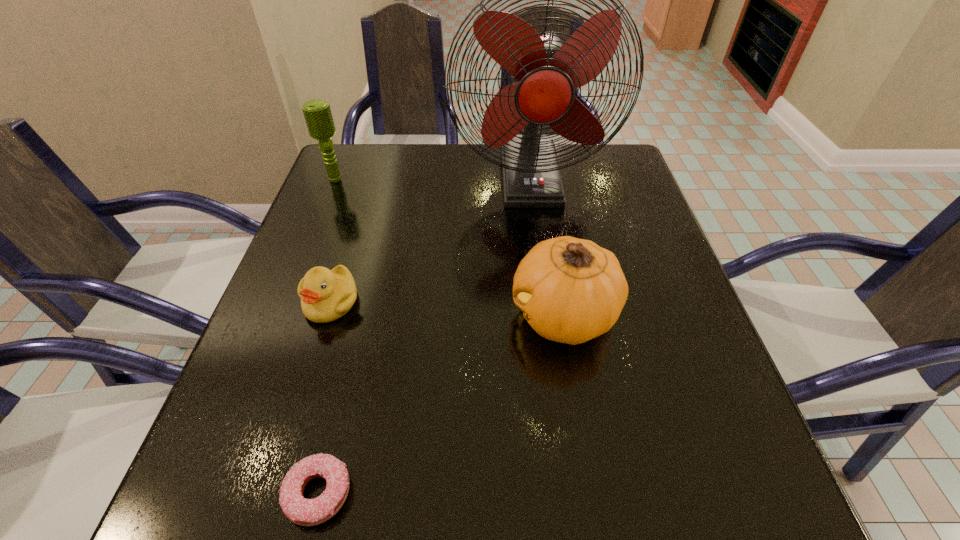
Locate an element on the screen. free space between the pumpkin and the microphone is located at coordinates (449, 247).

Where is `vacant area that lies between the microphone and the second shortest object`? Image resolution: width=960 pixels, height=540 pixels. vacant area that lies between the microphone and the second shortest object is located at coordinates (333, 240).

You are a GUI agent. You are given a task and a screenshot of the screen. Output one action in this format:
    pyautogui.click(x=<x>, y=<y>)
    Task: Click on the vacant area between the microphone and the tallest object
    
    Given the screenshot: What is the action you would take?
    pyautogui.click(x=433, y=178)

This screenshot has height=540, width=960. I want to click on free space between the second shortest object and the pumpkin, so click(x=447, y=308).

I want to click on blank region between the shortest object and the microphone, so click(327, 335).

You are a GUI agent. You are given a task and a screenshot of the screen. Output one action in this format:
    pyautogui.click(x=<x>, y=<y>)
    Task: Click on the vacant area that lies between the doughnut and the duckling
    
    Given the screenshot: What is the action you would take?
    point(324,397)

This screenshot has width=960, height=540. Identify the location of vacant area between the pumpkin and the second shortest object. (447, 308).

This screenshot has height=540, width=960. I want to click on free area in between the pumpkin and the microphone, so click(449, 247).

Locate an element on the screen. This screenshot has width=960, height=540. free space that is in between the pumpkin and the microphone is located at coordinates (449, 247).

Identify the location of blank region between the shortest object and the microphone. (327, 335).